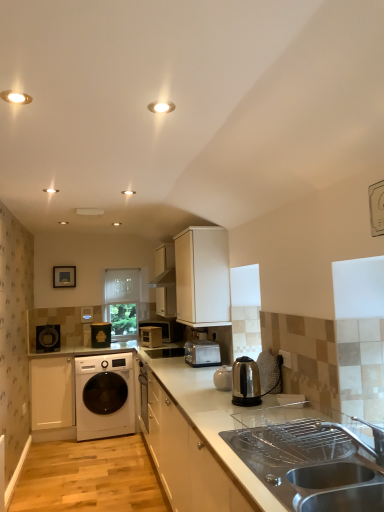
This screenshot has width=384, height=512. What are the coordinates of `vacant point above white glossy countertop at center (from a real-world perspective)` in the screenshot? It's located at (249, 413).